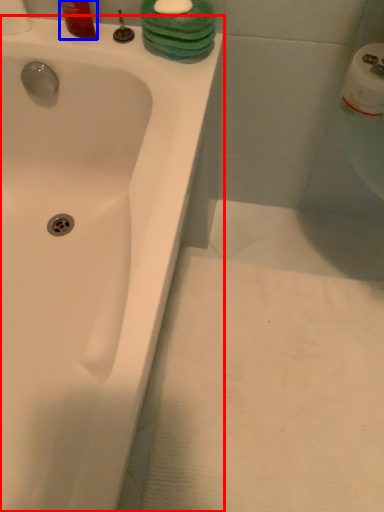
Question: Which object appears closest to the camera in this image, bathtub (highlighted by a red box) or liquid (highlighted by a blue box)?

Choices:
 (A) bathtub
 (B) liquid

Answer: (A)